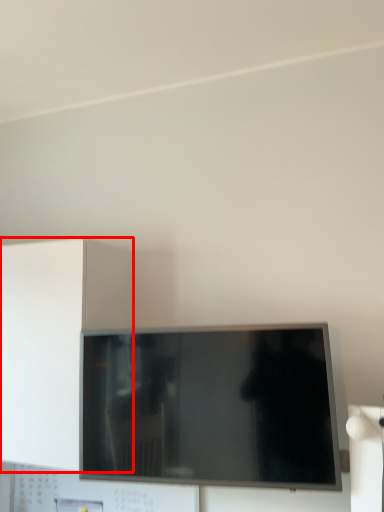
Question: From the image, what is the correct spatial relationship of cabinetry (annotated by the red box) in relation to television?

Choices:
 (A) left
 (B) right

Answer: (A)